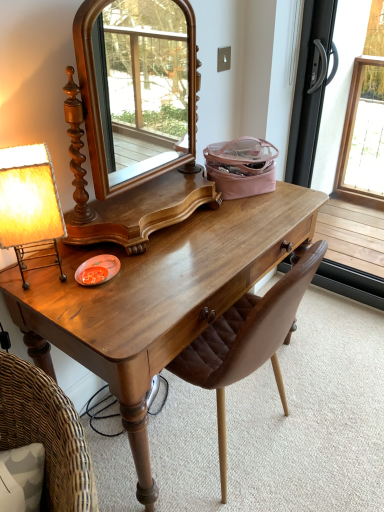
At what (x,y) coordinates should I click in order to perform the action: click on vacant area to the right of matte yellow fabric lampshade at left. Please return your answer as a coordinate pair (x, y). Looking at the image, I should click on (113, 274).